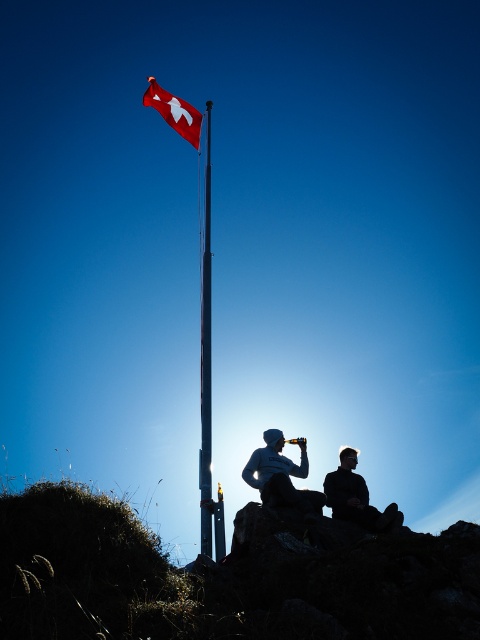
Who is lower down, silhouette clothing at center or matte black beanie at center?

Positioned lower is silhouette clothing at center.

Measure the distance between silhouette clothing at center and matte black beanie at center.

A distance of 35.99 inches exists between silhouette clothing at center and matte black beanie at center.

Is point (349, 476) positioned in front of point (259, 465)?

No, (349, 476) is behind (259, 465).

The width and height of the screenshot is (480, 640). Identify the location of silhouette clothing at center. (282, 476).

Can you confirm if silhouette clothing at center is positioned above silhouette fabric at lower right?

Yes, silhouette clothing at center is above silhouette fabric at lower right.

Which is more to the left, silhouette clothing at center or silhouette fabric at lower right?

From the viewer's perspective, silhouette clothing at center appears more on the left side.

Is point (305, 496) behind point (338, 492)?

No.

Find the location of `silhouette clothing at center`. silhouette clothing at center is located at coordinates (282, 476).

Is matte black beanie at center wider than red fabric flag at upper center?

No, matte black beanie at center is not wider than red fabric flag at upper center.

Is matte black beanie at center positioned behind red fabric flag at upper center?

That is False.

Does point (273, 468) lie in front of point (168, 99)?

Yes.

Identify the location of matte black beanie at center. (282, 476).